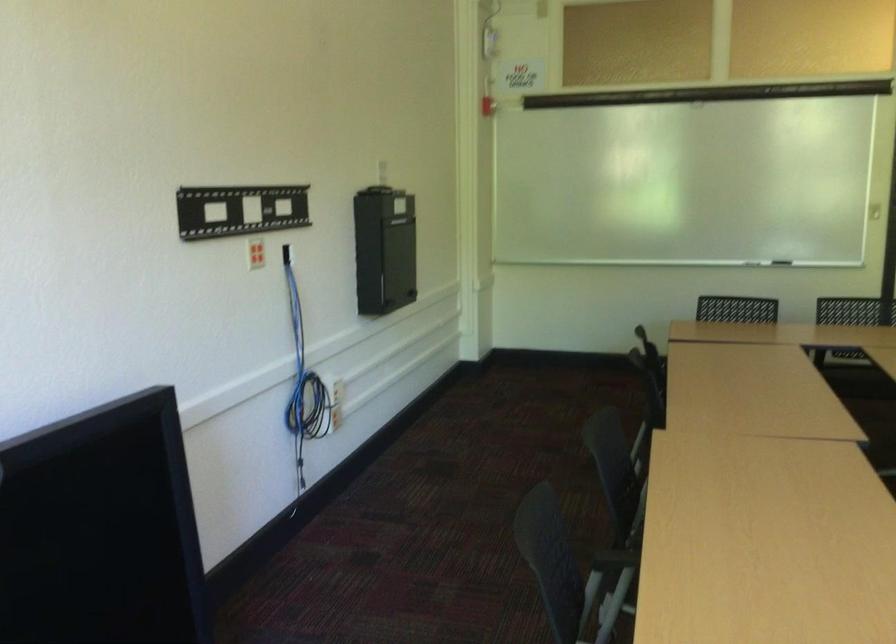
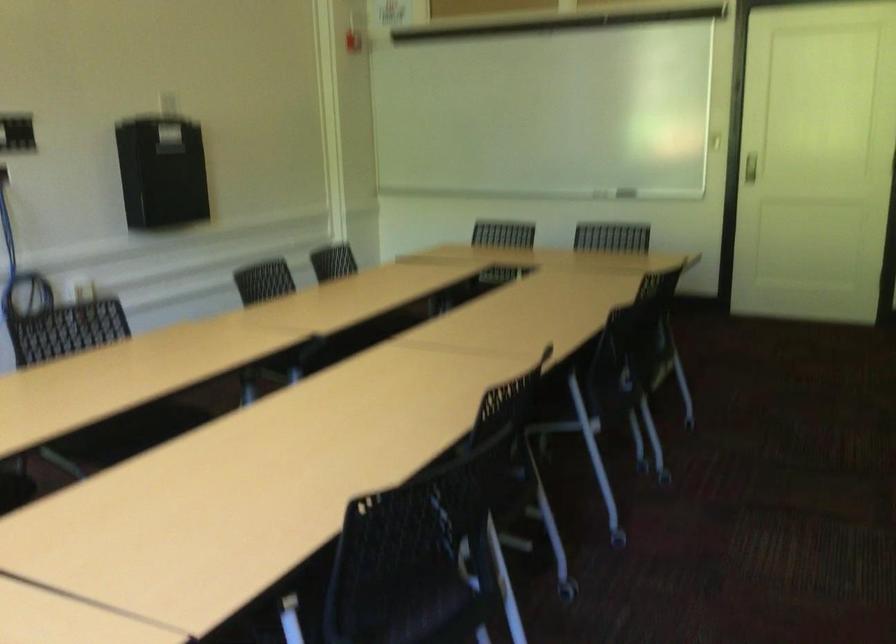
Question: Which direction would the cameraman need to move to produce the second image? Reply with the corresponding letter.

Choices:
 (A) Left
 (B) Right
 (C) Forward
 (D) Backward

Answer: (B)